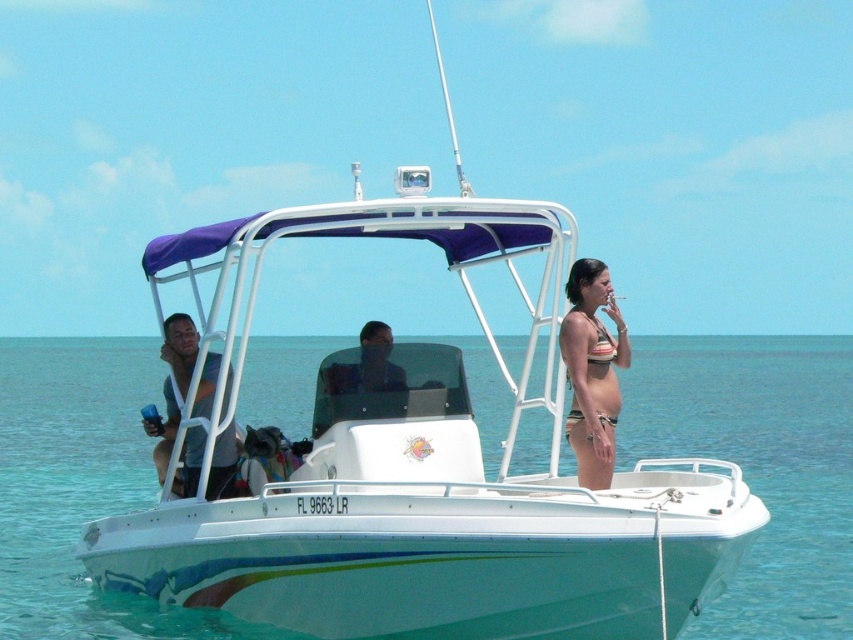
Question: Does light blue fabric shirt at center have a smaller size compared to striped fabric bikini at right?

Choices:
 (A) no
 (B) yes

Answer: (B)

Question: Does striped bikini at center appear under light blue fabric shirt at center?

Choices:
 (A) no
 (B) yes

Answer: (A)

Question: Which of the following is the farthest from the observer?

Choices:
 (A) striped bikini at center
 (B) striped fabric bikini at right
 (C) light blue fabric shirt at center
 (D) clear blue water at boat center

Answer: (B)

Question: Does clear blue water at boat center have a larger size compared to striped fabric bikini at right?

Choices:
 (A) yes
 (B) no

Answer: (A)

Question: Which object appears closest to the camera in this image?

Choices:
 (A) clear blue water at boat center
 (B) light blue fabric shirt at center
 (C) striped fabric bikini at right
 (D) striped bikini at center

Answer: (A)

Question: Which of the following is the farthest from the observer?

Choices:
 (A) light blue fabric shirt at center
 (B) clear blue water at boat center

Answer: (A)